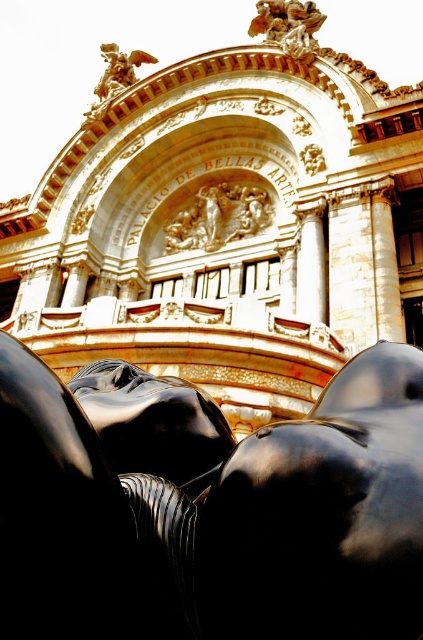
Is black glossy statue at center shorter than white marble column at center?

Indeed, black glossy statue at center has a lesser height compared to white marble column at center.

Describe the element at coordinates (153, 422) in the screenshot. I see `black glossy statue at center` at that location.

I want to click on black glossy statue at center, so click(153, 422).

Who is lower down, black polished statue at lower center or gold/gilded relief at center?

Positioned lower is black polished statue at lower center.

Does black polished statue at lower center appear on the left side of gold/gilded relief at center?

Incorrect, black polished statue at lower center is not on the left side of gold/gilded relief at center.

You are a GUI agent. You are given a task and a screenshot of the screen. Output one action in this format:
    pyautogui.click(x=<x>, y=<y>)
    Task: Click on the black polished statue at lower center
    
    Given the screenshot: What is the action you would take?
    pyautogui.click(x=216, y=518)

Identify the location of black polished statue at lower center. (216, 518).

Which is above, black polished statue at lower center or gold ornate statue at upper center?

gold ornate statue at upper center is higher up.

Does black polished statue at lower center have a smaller size compared to gold ornate statue at upper center?

Yes.

You are a GUI agent. You are given a task and a screenshot of the screen. Output one action in this format:
    pyautogui.click(x=<x>, y=<y>)
    Task: Click on the black polished statue at lower center
    
    Given the screenshot: What is the action you would take?
    pyautogui.click(x=216, y=518)